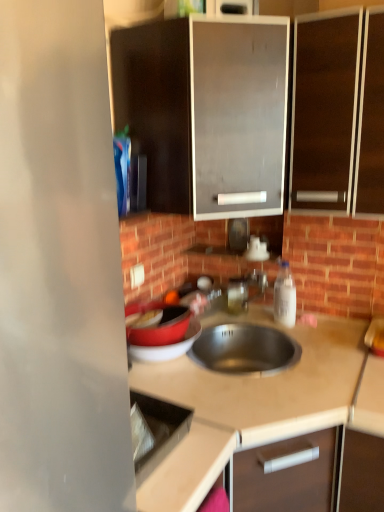
This screenshot has width=384, height=512. Find the location of `vacant space situated on the left part of white plastic bottle at right`. vacant space situated on the left part of white plastic bottle at right is located at coordinates (258, 326).